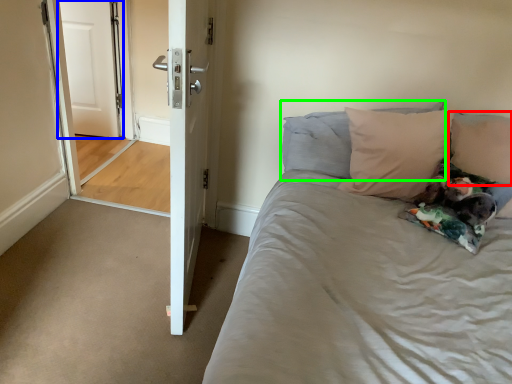
Question: Estimate the real-world distances between objects in this image. Which object is closer to pillow (highlighted by a red box), door (highlighted by a blue box) or pillow (highlighted by a green box)?

Choices:
 (A) door
 (B) pillow

Answer: (B)